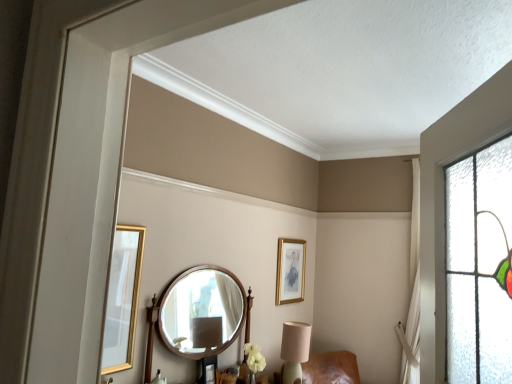
Describe the element at coordinates (295, 350) in the screenshot. I see `matte beige table lamp at lower center` at that location.

Where is `wooden round mirror at center`? This screenshot has height=384, width=512. wooden round mirror at center is located at coordinates (202, 311).

Between point (287, 346) and point (283, 297), which one is positioned behind?

The point (283, 297) is more distant.

Is matte beige table lamp at lower center far away from gold-framed picture at upper center?

That's not correct — matte beige table lamp at lower center is a little close to gold-framed picture at upper center.

From a real-world perspective, who is located lower, matte beige table lamp at lower center or gold-framed picture at upper center?

From a 3D spatial view, matte beige table lamp at lower center is below.

How different are the orientations of matte beige table lamp at lower center and gold-framed picture at upper center in degrees?

3.44e-05 degrees separate the facing orientations of matte beige table lamp at lower center and gold-framed picture at upper center.

How different are the orientations of wooden round mirror at center and gold-framed picture at upper center in degrees?

The facing directions of wooden round mirror at center and gold-framed picture at upper center are 7.86e-05 degrees apart.

Is wooden round mirror at center to the left of gold-framed picture at upper center from the viewer's perspective?

Correct, you'll find wooden round mirror at center to the left of gold-framed picture at upper center.

Does point (202, 290) appear closer or farther from the camera than point (286, 241)?

Point (202, 290) is farther from the camera than point (286, 241).

Is wooden round mirror at center bigger or smaller than gold-framed picture at upper center?

wooden round mirror at center is bigger than gold-framed picture at upper center.

Considering the sizes of objects matte beige table lamp at lower center and wooden round mirror at center in the image provided, who is taller, matte beige table lamp at lower center or wooden round mirror at center?

Standing taller between the two is wooden round mirror at center.

Are matte beige table lamp at lower center and wooden round mirror at center making contact?

No, matte beige table lamp at lower center is not with wooden round mirror at center.

Which is more to the left, matte beige table lamp at lower center or wooden round mirror at center?

Positioned to the left is wooden round mirror at center.

From a real-world perspective, is matte beige table lamp at lower center over wooden round mirror at center?

Incorrect, from a real-world perspective, matte beige table lamp at lower center is lower than wooden round mirror at center.

Is gold-framed picture at upper center positioned far away from matte beige table lamp at lower center?

gold-framed picture at upper center is actually quite close to matte beige table lamp at lower center.

Which point is more forward, (284,245) or (298,324)?

Positioned in front is point (298,324).

You are a GUI agent. You are given a task and a screenshot of the screen. Output one action in this format:
    pyautogui.click(x=<x>, y=<y>)
    Task: Click on the picture frame behind the matte beige table lamp at lower center
    Image resolution: width=512 pixels, height=384 pixels.
    Given the screenshot: What is the action you would take?
    pyautogui.click(x=290, y=271)

How different are the orientations of wooden round mirror at center and matte beige table lamp at lower center in degrees?

0.000111 degrees.

Which object is thinner, wooden round mirror at center or matte beige table lamp at lower center?

With smaller width is wooden round mirror at center.

From their relative heights in the image, would you say wooden round mirror at center is taller or shorter than matte beige table lamp at lower center?

In the image, wooden round mirror at center appears to be taller than matte beige table lamp at lower center.

In the scene shown: Which is correct: gold-framed picture at upper center is inside wooden round mirror at center, or outside of it?

gold-framed picture at upper center exists outside the volume of wooden round mirror at center.

How distant is gold-framed picture at upper center from wooden round mirror at center?

A distance of 81.30 centimeters exists between gold-framed picture at upper center and wooden round mirror at center.

I want to click on mirror on the left of gold-framed picture at upper center, so (202, 311).

You are a GUI agent. You are given a task and a screenshot of the screen. Output one action in this format:
    pyautogui.click(x=<x>, y=<y>)
    Task: Click on the picture frame above the matte beige table lamp at lower center (from a real-world perspective)
    
    Given the screenshot: What is the action you would take?
    pyautogui.click(x=290, y=271)

The width and height of the screenshot is (512, 384). I want to click on mirror that appears below the gold-framed picture at upper center (from a real-world perspective), so click(x=202, y=311).

When comparing their distances from gold-framed picture at upper center, does wooden round mirror at center or matte beige table lamp at lower center seem further?

wooden round mirror at center is positioned further to the anchor gold-framed picture at upper center.

From the image, which object appears to be farther from matte beige table lamp at lower center, wooden round mirror at center or gold-framed picture at upper center?

gold-framed picture at upper center is positioned further to the anchor matte beige table lamp at lower center.

Which object lies further to the anchor point wooden round mirror at center, matte beige table lamp at lower center or gold-framed picture at upper center?

Based on the image, gold-framed picture at upper center appears to be further to wooden round mirror at center.

Which object lies nearer to the anchor point gold-framed picture at upper center, matte beige table lamp at lower center or wooden round mirror at center?

matte beige table lamp at lower center lies closer to gold-framed picture at upper center than the other object.

Based on their spatial positions, is gold-framed picture at upper center or wooden round mirror at center further from matte beige table lamp at lower center?

gold-framed picture at upper center lies further to matte beige table lamp at lower center than the other object.

Considering their positions, is gold-framed picture at upper center positioned further to wooden round mirror at center than matte beige table lamp at lower center?

gold-framed picture at upper center.

You are a GUI agent. You are given a task and a screenshot of the screen. Output one action in this format:
    pyautogui.click(x=<x>, y=<y>)
    Task: Click on the table lamp located between wooden round mirror at center and gold-framed picture at upper center in the depth direction
    
    Given the screenshot: What is the action you would take?
    pyautogui.click(x=295, y=350)